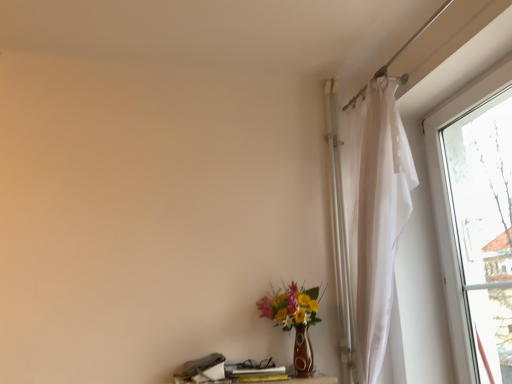
Question: Should I look upward or downward to see matte brown vase at lower center?

Choices:
 (A) down
 (B) up

Answer: (A)

Question: Considering the relative sizes of wooden table at lower center and matte brown vase at lower center in the image provided, is wooden table at lower center thinner than matte brown vase at lower center?

Choices:
 (A) yes
 (B) no

Answer: (A)

Question: Would you say wooden table at lower center contains matte brown vase at lower center?

Choices:
 (A) no
 (B) yes

Answer: (A)

Question: From the image's perspective, would you say wooden table at lower center is shown under matte brown vase at lower center?

Choices:
 (A) yes
 (B) no

Answer: (A)

Question: Is wooden table at lower center shorter than matte brown vase at lower center?

Choices:
 (A) no
 (B) yes

Answer: (B)

Question: From the image's perspective, is wooden table at lower center above matte brown vase at lower center?

Choices:
 (A) yes
 (B) no

Answer: (B)

Question: Does wooden table at lower center lie in front of matte brown vase at lower center?

Choices:
 (A) no
 (B) yes

Answer: (B)

Question: Can you confirm if matte brown vase at lower center is bigger than wooden table at lower center?

Choices:
 (A) yes
 (B) no

Answer: (A)

Question: From a real-world perspective, does matte brown vase at lower center stand above wooden table at lower center?

Choices:
 (A) yes
 (B) no

Answer: (A)

Question: Is matte brown vase at lower center smaller than wooden table at lower center?

Choices:
 (A) yes
 (B) no

Answer: (B)

Question: From a real-world perspective, is matte brown vase at lower center physically below wooden table at lower center?

Choices:
 (A) yes
 (B) no

Answer: (B)

Question: Is matte brown vase at lower center surrounding wooden table at lower center?

Choices:
 (A) yes
 (B) no

Answer: (B)

Question: Is matte brown vase at lower center oriented towards wooden table at lower center?

Choices:
 (A) no
 (B) yes

Answer: (A)

Question: Based on their positions, is matte brown vase at lower center located to the left or right of wooden table at lower center?

Choices:
 (A) left
 (B) right

Answer: (B)